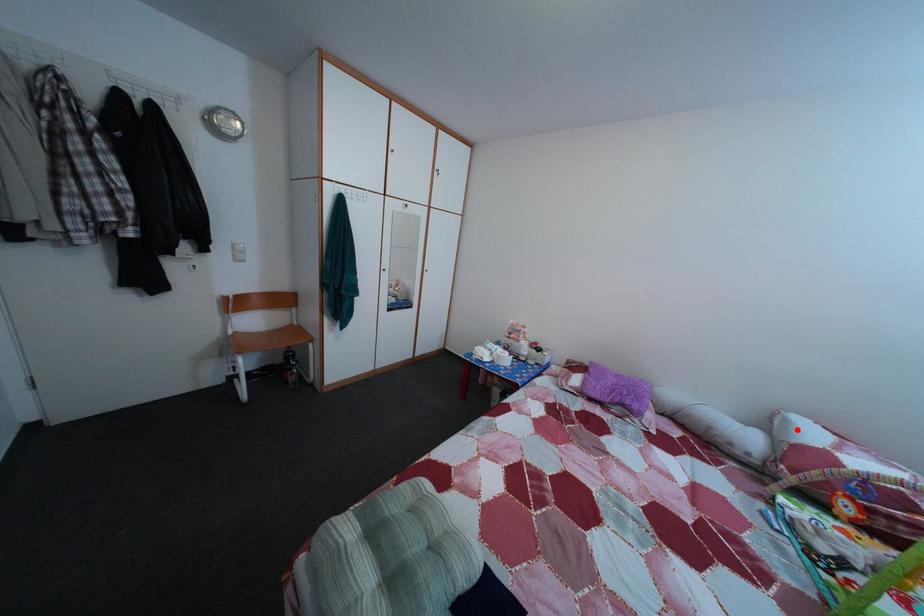
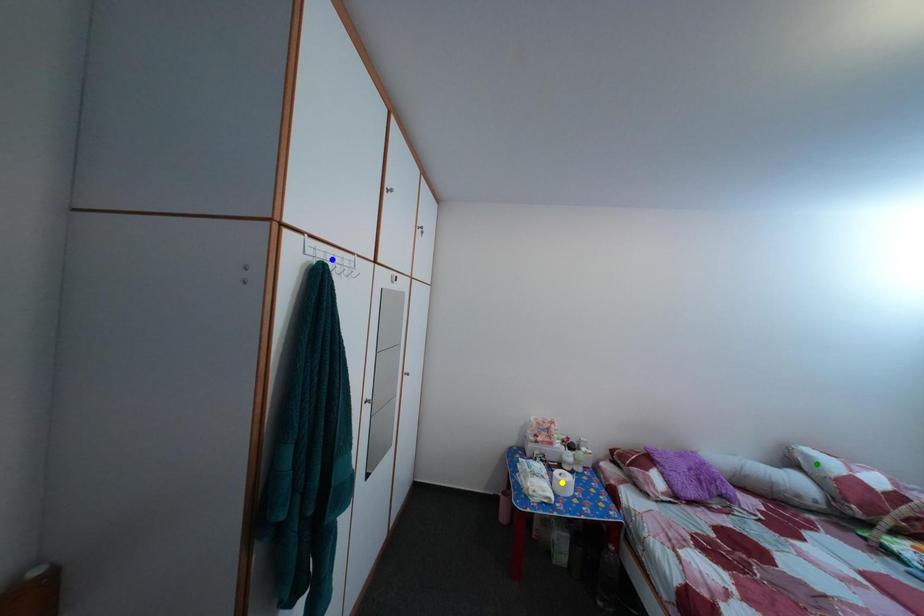
Question: I am providing you with two images of the same scene from different viewpoints. A red point is marked on the first image. You are given multiple points on the second image. Can you choose the point in image 2 that corresponds to the point in image 1?

Choices:
 (A) green point
 (B) blue point
 (C) yellow point

Answer: (A)